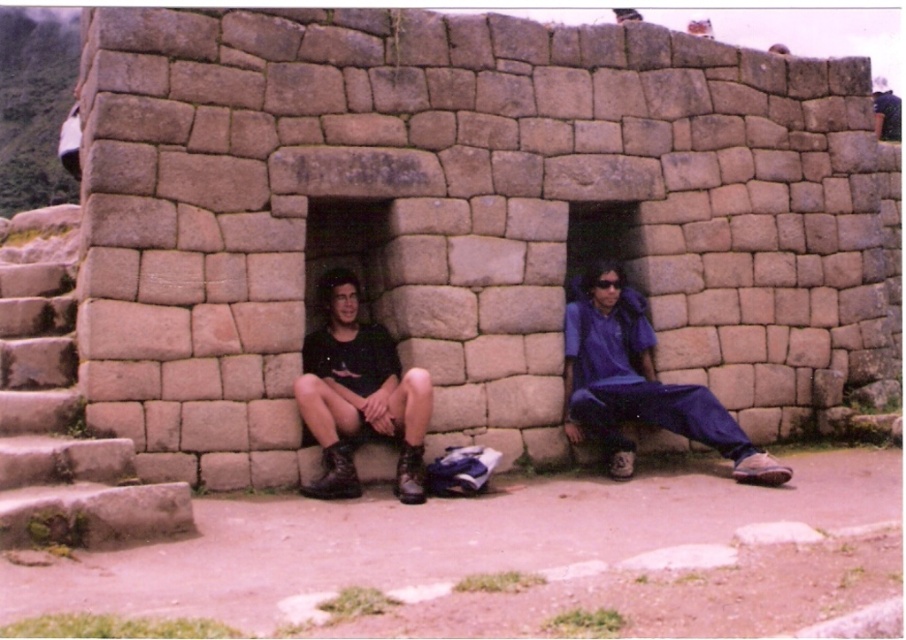
Is dark blue fabric pants at center smaller than rustic stone stairs at lower left?

Yes.

Does dark blue fabric pants at center appear on the right side of rustic stone stairs at lower left?

Correct, you'll find dark blue fabric pants at center to the right of rustic stone stairs at lower left.

I want to click on dark blue fabric pants at center, so click(x=639, y=385).

The width and height of the screenshot is (906, 640). Identify the location of dark blue fabric pants at center. (639, 385).

Between rustic stone stairs at lower left and black matte boots at lower left, which one is positioned higher?

black matte boots at lower left is higher up.

Is rustic stone stairs at lower left behind black matte boots at lower left?

No, it is not.

Locate an element on the screen. The width and height of the screenshot is (906, 640). rustic stone stairs at lower left is located at coordinates (63, 433).

Can you confirm if dark blue fabric pants at center is positioned to the right of black matte boots at lower left?

No, dark blue fabric pants at center is not to the right of black matte boots at lower left.

Is point (620, 419) less distant than point (355, 408)?

That is False.

Locate an element on the screen. The height and width of the screenshot is (640, 906). dark blue fabric pants at center is located at coordinates coord(639,385).